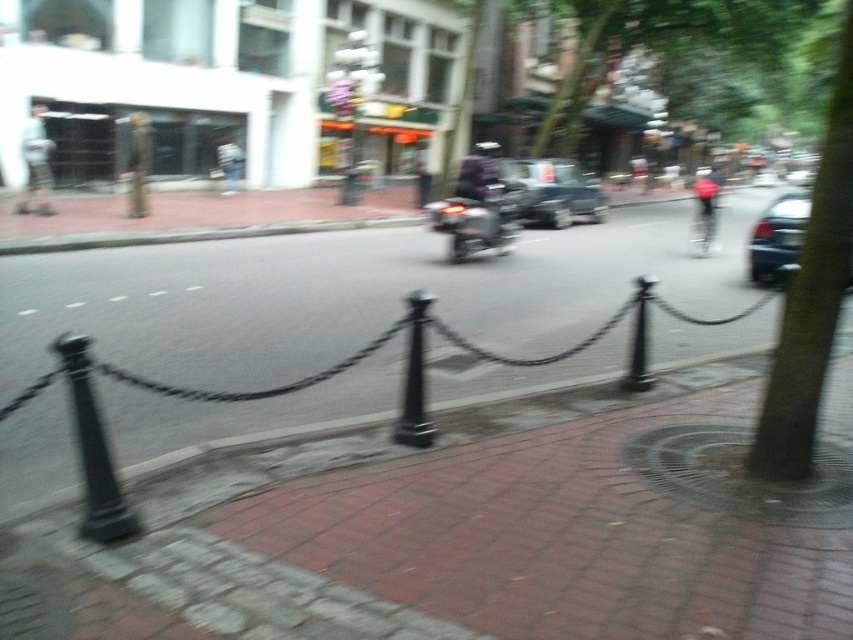
You are a delivery person trying to navigate through the street. There is a black metal pole at lower left and a shiny metallic motorcycle at center. Which object is positioned more to the left side of the street?

The black metal pole at lower left is positioned more to the left side of the street than the shiny metallic motorcycle at center.